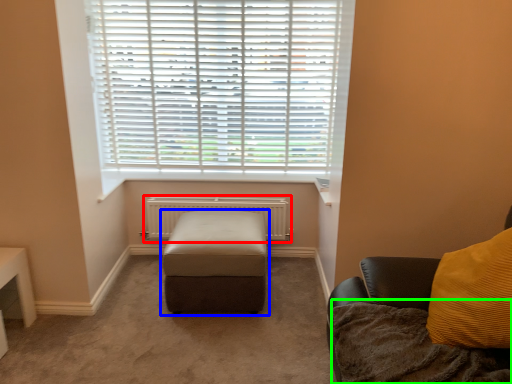
Question: Estimate the real-world distances between objects in this image. Which object is farther from radiator (highlighted by a red box), furniture (highlighted by a blue box) or blanket (highlighted by a green box)?

Choices:
 (A) furniture
 (B) blanket

Answer: (B)